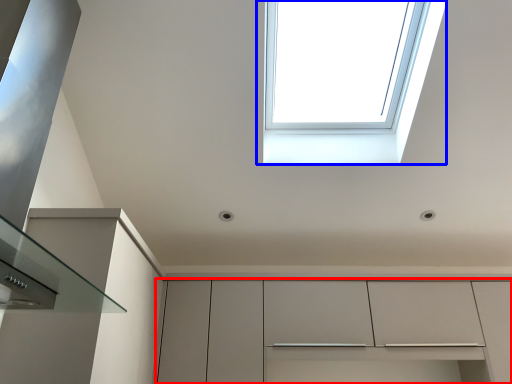
Question: Which object is closer to the camera taking this photo, cabinetry (highlighted by a red box) or window (highlighted by a blue box)?

Choices:
 (A) cabinetry
 (B) window

Answer: (B)